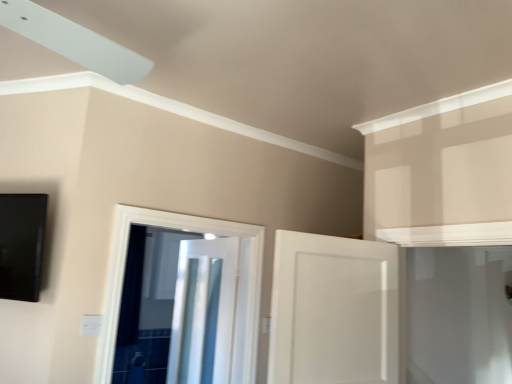
Question: Is white glossy door at center, which is the 2th door from back to front, in front of white glossy door at center, positioned as the first door in front-to-back order?

Choices:
 (A) no
 (B) yes

Answer: (A)

Question: Is white glossy door at center, which is the 2th door from back to front, to the left of white glossy door at center, arranged as the third door when viewed from the back, from the viewer's perspective?

Choices:
 (A) no
 (B) yes

Answer: (B)

Question: Considering the relative sizes of white glossy door at center, which is the 2th door from back to front, and white glossy door at center, arranged as the third door when viewed from the back, in the image provided, is white glossy door at center, which is the 2th door from back to front, smaller than white glossy door at center, arranged as the third door when viewed from the back,?

Choices:
 (A) yes
 (B) no

Answer: (A)

Question: From a real-world perspective, does white glossy door at center, which is the second door from front to back, sit lower than white glossy door at center, positioned as the first door in front-to-back order?

Choices:
 (A) no
 (B) yes

Answer: (B)

Question: Could you tell me if white glossy door at center, which is the second door from front to back, is facing white glossy door at center, arranged as the third door when viewed from the back?

Choices:
 (A) no
 (B) yes

Answer: (A)

Question: From a real-world perspective, is white glossy door at center, which is the second door from front to back, positioned above or below metallic silver door at center, the 3th door viewed from the front?

Choices:
 (A) above
 (B) below

Answer: (A)

Question: In terms of width, does white glossy door at center, which is the 2th door from back to front, look wider or thinner when compared to metallic silver door at center, the 3th door viewed from the front?

Choices:
 (A) wide
 (B) thin

Answer: (A)

Question: Considering their positions, is white glossy door at center, which is the 2th door from back to front, located in front of or behind metallic silver door at center, the 3th door viewed from the front?

Choices:
 (A) front
 (B) behind

Answer: (A)

Question: In terms of height, does white glossy door at center, which is the 2th door from back to front, look taller or shorter compared to metallic silver door at center, the 3th door viewed from the front?

Choices:
 (A) tall
 (B) short

Answer: (B)

Question: From the image's perspective, is metallic silver door at center, the first door positioned from the back, positioned above or below white glossy door at center, positioned as the first door in front-to-back order?

Choices:
 (A) below
 (B) above

Answer: (A)

Question: In terms of width, does metallic silver door at center, the first door positioned from the back, look wider or thinner when compared to white glossy door at center, positioned as the first door in front-to-back order?

Choices:
 (A) wide
 (B) thin

Answer: (B)

Question: Is metallic silver door at center, the 3th door viewed from the front, taller or shorter than white glossy door at center, positioned as the first door in front-to-back order?

Choices:
 (A) tall
 (B) short

Answer: (A)

Question: From a real-world perspective, is metallic silver door at center, the first door positioned from the back, positioned above or below white glossy door at center, positioned as the first door in front-to-back order?

Choices:
 (A) below
 (B) above

Answer: (A)

Question: From the image's perspective, is white glossy door at center, positioned as the first door in front-to-back order, positioned above or below white glossy door at center, which is the second door from front to back?

Choices:
 (A) above
 (B) below

Answer: (A)

Question: In terms of width, does white glossy door at center, positioned as the first door in front-to-back order, look wider or thinner when compared to white glossy door at center, which is the second door from front to back?

Choices:
 (A) wide
 (B) thin

Answer: (B)